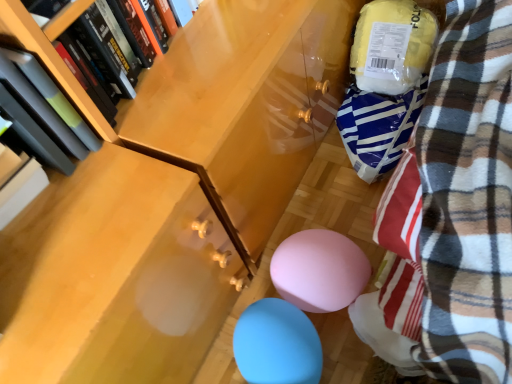
Locate an element on the screen. The height and width of the screenshot is (384, 512). hardcover book at upper left, which appears as the 2th book when viewed from the left is located at coordinates (114, 44).

You are a GUI agent. You are given a task and a screenshot of the screen. Output one action in this format:
    pyautogui.click(x=<x>, y=<y>)
    Task: Click on the matte black book at left, the 2th book viewed from the right
    The image size is (512, 384).
    Given the screenshot: What is the action you would take?
    pyautogui.click(x=46, y=103)

Identify the location of hardcover book at upper left, the first book when ordered from right to left. (114, 44).

Can you confirm if hardcover book at upper left, which appears as the 2th book when viewed from the left, is shorter than blue rubber balloon at lower center?

Correct, hardcover book at upper left, which appears as the 2th book when viewed from the left, is not as tall as blue rubber balloon at lower center.

Looking at this image, can you confirm if hardcover book at upper left, the first book when ordered from right to left, is thinner than blue rubber balloon at lower center?

Correct, the width of hardcover book at upper left, the first book when ordered from right to left, is less than that of blue rubber balloon at lower center.

Is hardcover book at upper left, which appears as the 2th book when viewed from the left, facing towards blue rubber balloon at lower center?

No, hardcover book at upper left, which appears as the 2th book when viewed from the left, is not turned towards blue rubber balloon at lower center.

Considering the points (73, 26) and (250, 352), which point is behind, point (73, 26) or point (250, 352)?

The point (250, 352) is farther.

Is blue rubber balloon at lower center touching matte black book at left, the 2th book viewed from the right?

No, blue rubber balloon at lower center is not making contact with matte black book at left, the 2th book viewed from the right.

From a real-world perspective, is blue rubber balloon at lower center below matte black book at left, arranged as the first book when viewed from the left?

Yes, from a real-world perspective, blue rubber balloon at lower center is beneath matte black book at left, arranged as the first book when viewed from the left.

Is point (255, 358) closer or farther from the camera than point (70, 152)?

Clearly, point (255, 358) is more distant from the camera than point (70, 152).

From the picture: Is blue rubber balloon at lower center oriented away from matte black book at left, the 2th book viewed from the right?

That's not correct — blue rubber balloon at lower center is not looking away from matte black book at left, the 2th book viewed from the right.

Identify the location of book above the matte black book at left, arranged as the first book when viewed from the left (from the image's perspective). This screenshot has height=384, width=512. (114, 44).

Which object is wider, hardcover book at upper left, the first book when ordered from right to left, or matte black book at left, arranged as the first book when viewed from the left?

matte black book at left, arranged as the first book when viewed from the left, is wider.

From their relative heights in the image, would you say hardcover book at upper left, which appears as the 2th book when viewed from the left, is taller or shorter than matte black book at left, arranged as the first book when viewed from the left?

hardcover book at upper left, which appears as the 2th book when viewed from the left, is shorter than matte black book at left, arranged as the first book when viewed from the left.

Considering the sizes of objects hardcover book at upper left, which appears as the 2th book when viewed from the left, and matte black book at left, arranged as the first book when viewed from the left, in the image provided, who is bigger, hardcover book at upper left, which appears as the 2th book when viewed from the left, or matte black book at left, arranged as the first book when viewed from the left,?

matte black book at left, arranged as the first book when viewed from the left, is bigger.

Is blue rubber balloon at lower center to the right of hardcover book at upper left, which appears as the 2th book when viewed from the left, from the viewer's perspective?

Yes, blue rubber balloon at lower center is to the right of hardcover book at upper left, which appears as the 2th book when viewed from the left.

From a real-world perspective, is blue rubber balloon at lower center located beneath hardcover book at upper left, which appears as the 2th book when viewed from the left?

Yes.

Find the location of a particular element. book that is the 1st object to the left of the blue rubber balloon at lower center, starting at the anchor is located at coordinates (114, 44).

Which object is closer to the camera taking this photo, blue rubber balloon at lower center or hardcover book at upper left, which appears as the 2th book when viewed from the left?

hardcover book at upper left, which appears as the 2th book when viewed from the left.

You are a GUI agent. You are given a task and a screenshot of the screen. Output one action in this format:
    pyautogui.click(x=<x>, y=<y>)
    Task: Click on the balloon below the matte black book at left, arranged as the first book when viewed from the left (from a real-world perspective)
    
    Given the screenshot: What is the action you would take?
    pyautogui.click(x=277, y=344)

From a real-world perspective, is matte black book at left, the 2th book viewed from the right, beneath blue rubber balloon at lower center?

No, from a real-world perspective, matte black book at left, the 2th book viewed from the right, is not under blue rubber balloon at lower center.

Between matte black book at left, the 2th book viewed from the right, and blue rubber balloon at lower center, which one has less height?

Standing shorter between the two is blue rubber balloon at lower center.

Based on the photo, would you say hardcover book at upper left, the first book when ordered from right to left, is part of matte black book at left, arranged as the first book when viewed from the left,'s contents?

No, hardcover book at upper left, the first book when ordered from right to left, is not a part of matte black book at left, arranged as the first book when viewed from the left.

Are matte black book at left, arranged as the first book when viewed from the left, and hardcover book at upper left, the first book when ordered from right to left, beside each other?

No, matte black book at left, arranged as the first book when viewed from the left, is not with hardcover book at upper left, the first book when ordered from right to left.

Is hardcover book at upper left, which appears as the 2th book when viewed from the left, at the back of matte black book at left, the 2th book viewed from the right?

No, matte black book at left, the 2th book viewed from the right, is not facing the opposite direction of hardcover book at upper left, which appears as the 2th book when viewed from the left.

In the image, is matte black book at left, the 2th book viewed from the right, on the left side or the right side of hardcover book at upper left, the first book when ordered from right to left?

matte black book at left, the 2th book viewed from the right, is to the left of hardcover book at upper left, the first book when ordered from right to left.

Which book is the 1st one when counting from the left side of the blue rubber balloon at lower center? Please provide its 2D coordinates.

[(114, 44)]

Locate an element on the screen. The height and width of the screenshot is (384, 512). the 2nd book in front when counting from the blue rubber balloon at lower center is located at coordinates (46, 103).

From the image, which object appears to be farther from hardcover book at upper left, which appears as the 2th book when viewed from the left, blue rubber balloon at lower center or matte black book at left, the 2th book viewed from the right?

Based on the image, blue rubber balloon at lower center appears to be further to hardcover book at upper left, which appears as the 2th book when viewed from the left.

Estimate the real-world distances between objects in this image. Which object is further from hardcover book at upper left, the first book when ordered from right to left, matte black book at left, the 2th book viewed from the right, or blue rubber balloon at lower center?

blue rubber balloon at lower center is positioned further to the anchor hardcover book at upper left, the first book when ordered from right to left.

From the image, which object appears to be nearer to matte black book at left, the 2th book viewed from the right, hardcover book at upper left, the first book when ordered from right to left, or blue rubber balloon at lower center?

Among the two, hardcover book at upper left, the first book when ordered from right to left, is located nearer to matte black book at left, the 2th book viewed from the right.

When comparing their distances from blue rubber balloon at lower center, does hardcover book at upper left, which appears as the 2th book when viewed from the left, or matte black book at left, the 2th book viewed from the right, seem further?

The object further to blue rubber balloon at lower center is hardcover book at upper left, which appears as the 2th book when viewed from the left.

Which object lies nearer to the anchor point matte black book at left, the 2th book viewed from the right, blue rubber balloon at lower center or hardcover book at upper left, which appears as the 2th book when viewed from the left?

Based on the image, hardcover book at upper left, which appears as the 2th book when viewed from the left, appears to be nearer to matte black book at left, the 2th book viewed from the right.

Considering their positions, is matte black book at left, the 2th book viewed from the right, positioned closer to blue rubber balloon at lower center than hardcover book at upper left, which appears as the 2th book when viewed from the left?

The object closer to blue rubber balloon at lower center is matte black book at left, the 2th book viewed from the right.

The width and height of the screenshot is (512, 384). Identify the location of book between hardcover book at upper left, the first book when ordered from right to left, and blue rubber balloon at lower center in the up-down direction. (46, 103).